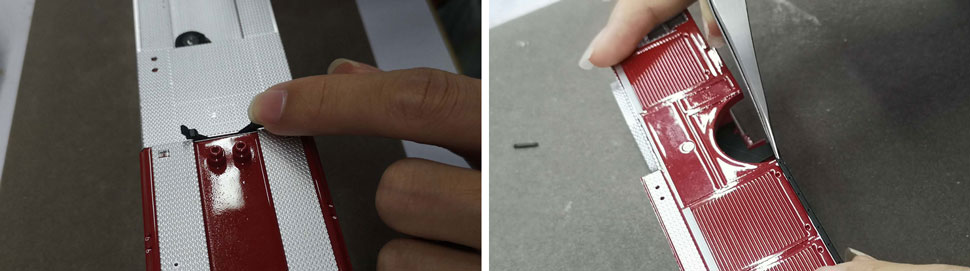
Where is `white line between pictures`? The image size is (970, 271). white line between pictures is located at coordinates (483, 22), (483, 92), (482, 230).